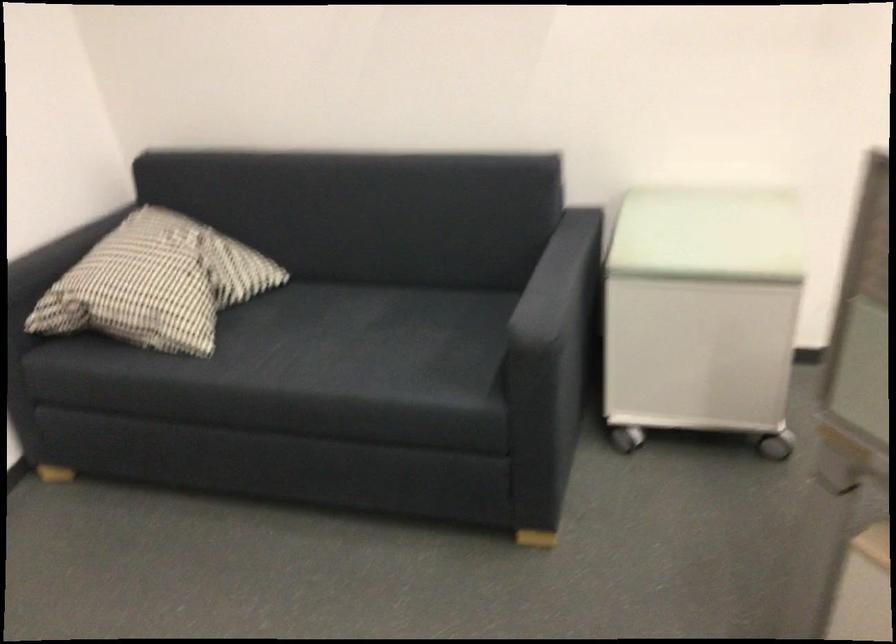
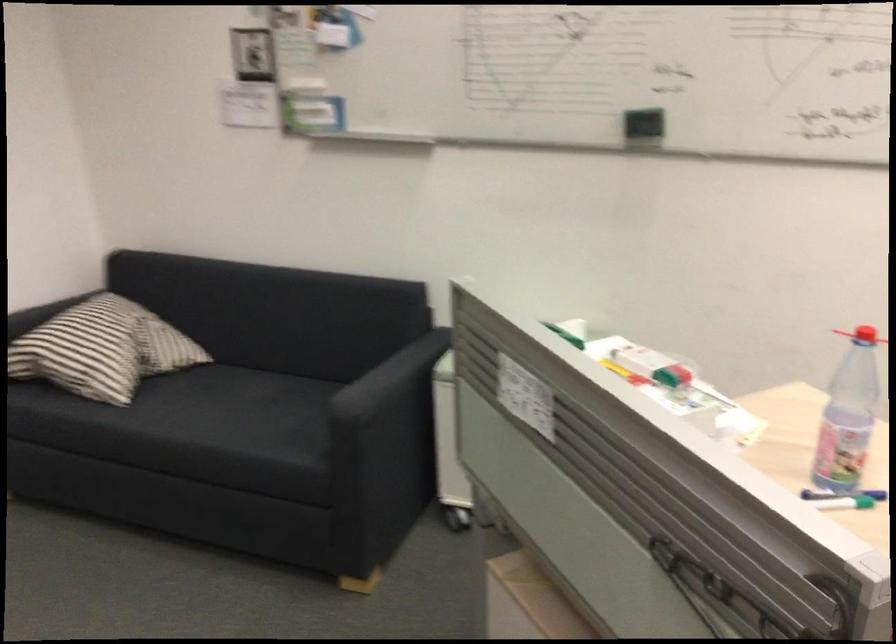
Question: The first image is from the beginning of the video and the second image is from the end. How did the camera likely rotate when shooting the video?

Choices:
 (A) Left
 (B) Right
 (C) Up
 (D) Down

Answer: (C)